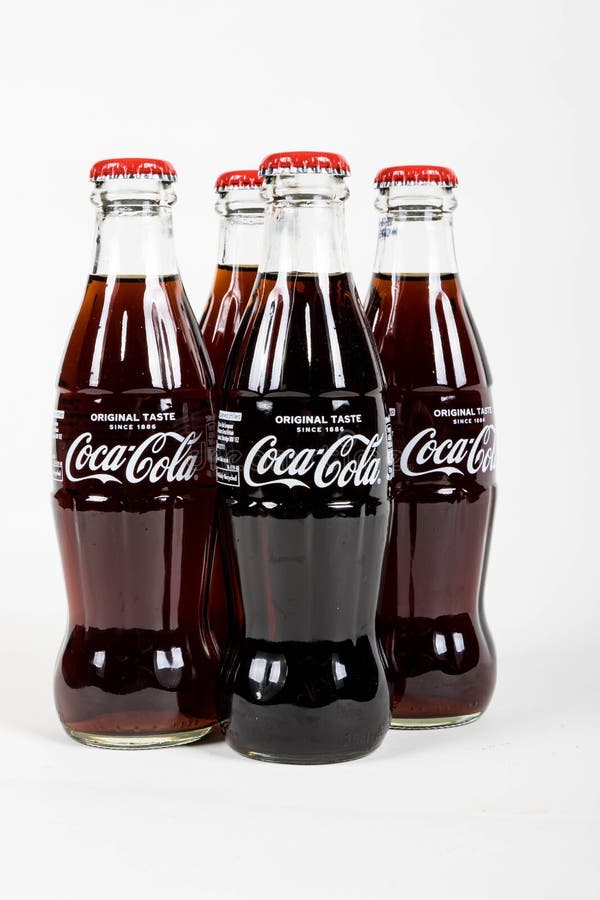
Identify the location of glass bottles. (182, 534), (228, 302), (428, 551), (338, 579).